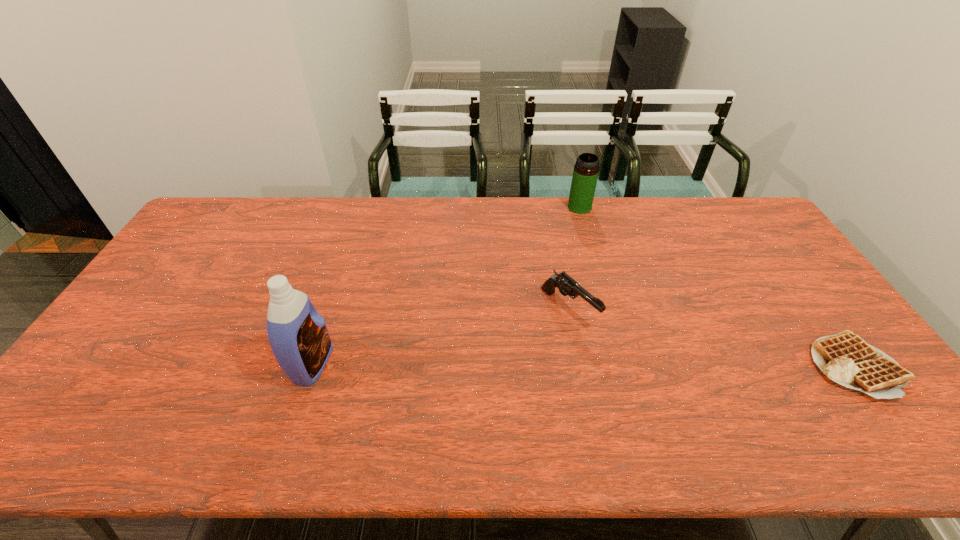
I want to click on vacant space on the desktop that is between the tallest object and the shortest object and is positioned at the end of the barrel of the gun, so click(635, 364).

You are a GUI agent. You are given a task and a screenshot of the screen. Output one action in this format:
    pyautogui.click(x=<x>, y=<y>)
    Task: Click on the free spot on the desktop that is between the leftmost object and the waffle and is positioned from the spout of the second tallest object
    This screenshot has width=960, height=540.
    Given the screenshot: What is the action you would take?
    pyautogui.click(x=601, y=364)